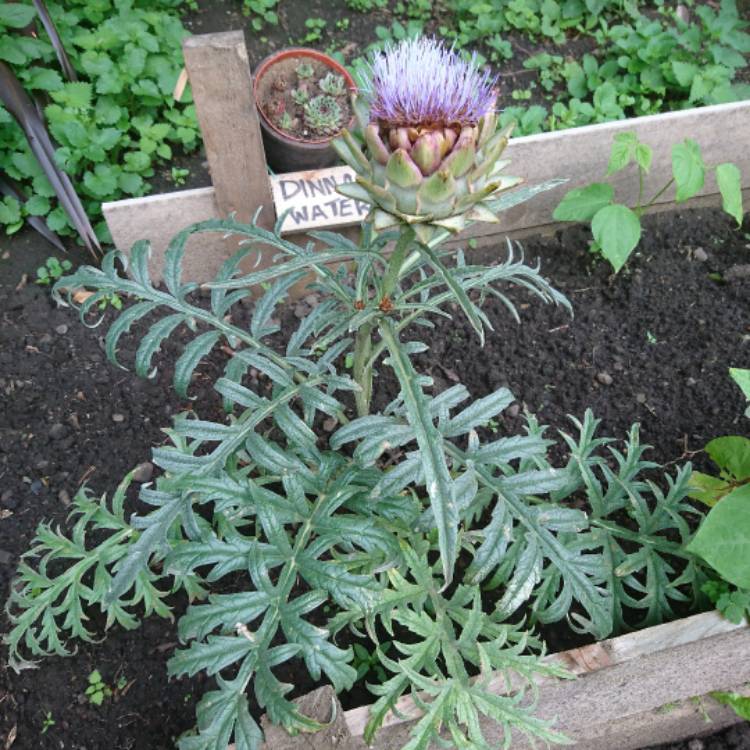
Identify the location of succulents. The image size is (750, 750). (330, 112), (325, 84), (300, 91).